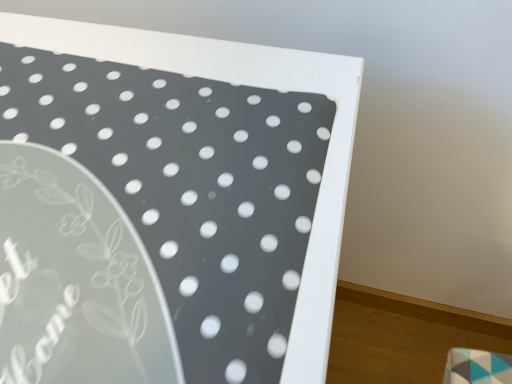
Question: Should I look upward or downward to see white glossy board at upper left?

Choices:
 (A) up
 (B) down

Answer: (B)